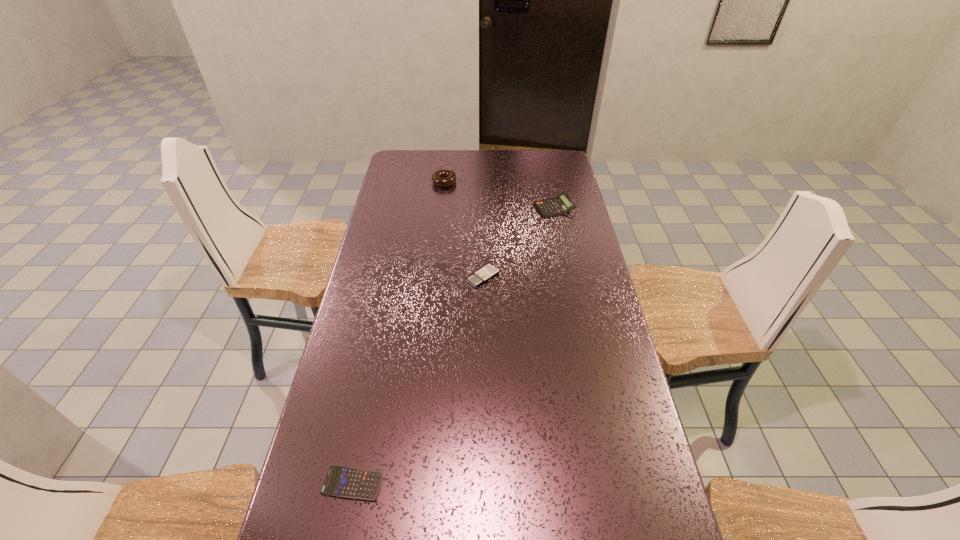
Locate an element on the screen. free space between the shortest calculator and the farthest calculator is located at coordinates (453, 346).

Find the location of a particular element. vacant area between the leftmost object and the farthest object is located at coordinates (398, 333).

At what (x,y) coordinates should I click in order to perform the action: click on unoccupied position between the second object from right to left and the leftmost calculator. Please return your answer as a coordinate pair (x, y). This screenshot has width=960, height=540. Looking at the image, I should click on (418, 380).

What are the coordinates of `unoccupied position between the farthest calculator and the nearest object` in the screenshot? It's located at (453, 346).

At what (x,y) coordinates should I click in order to perform the action: click on vacant space in between the second shortest object and the tallest calculator. Please return your answer as a coordinate pair (x, y). This screenshot has width=960, height=540. Looking at the image, I should click on (518, 242).

What are the coordinates of `free point between the third nearest object and the second calculator from left to right` in the screenshot? It's located at (518, 242).

This screenshot has height=540, width=960. In order to click on free space between the third nearest object and the third object from left to right in this screenshot , I will do `click(518, 242)`.

Find the location of a particular element. Image resolution: width=960 pixels, height=540 pixels. free spot between the second calculator from right to left and the leftmost object is located at coordinates (418, 380).

The image size is (960, 540). I want to click on free point between the second object from left to right and the tallest calculator, so coord(499,195).

Identify which object is located as the third nearest to the leftmost calculator. Please provide its 2D coordinates. Your answer should be formatted as a tuple, i.e. [(x, y)], where the tuple contains the x and y coordinates of a point satisfying the conditions above.

[(443, 178)]